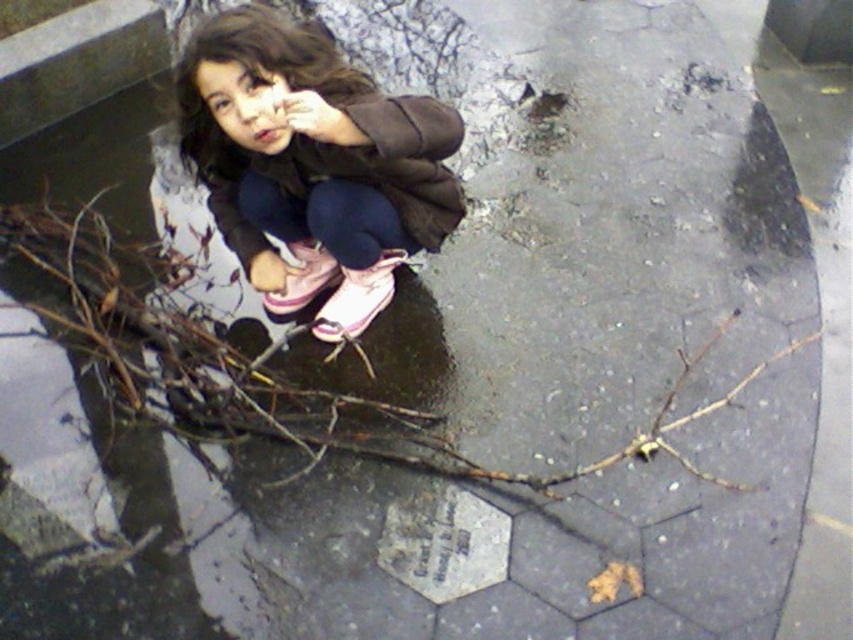
Is matte brown jacket at upper center shorter than brown wood branch at center?

Incorrect, matte brown jacket at upper center's height does not fall short of brown wood branch at center's.

Does matte brown jacket at upper center have a greater width compared to brown wood branch at center?

Incorrect, matte brown jacket at upper center's width does not surpass brown wood branch at center's.

Which is in front, point (357, 225) or point (231, 381)?

Point (357, 225)

Image resolution: width=853 pixels, height=640 pixels. Identify the location of matte brown jacket at upper center. (312, 164).